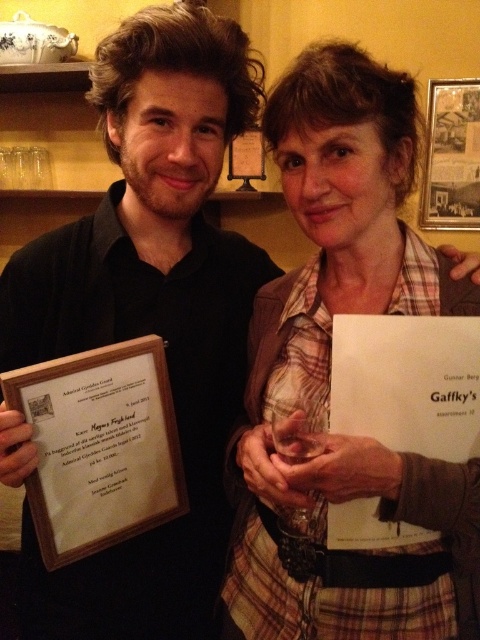
Question: Among these points, which one is nearest to the camera?

Choices:
 (A) (7, 333)
 (B) (464, 339)

Answer: (B)

Question: Estimate the real-world distances between objects in this image. Which object is closer to the wooden plaque at center?

Choices:
 (A) plaid fabric shirt at center
 (B) matte black shirt at center
 (C) white paper at center

Answer: (B)

Question: Is plaid fabric shirt at center smaller than wooden plaque at center?

Choices:
 (A) no
 (B) yes

Answer: (A)

Question: Which object is positioned closest to the white paper at center?

Choices:
 (A) matte black shirt at center
 (B) wooden plaque at center
 (C) plaid fabric shirt at center

Answer: (C)

Question: Does matte black shirt at center have a smaller size compared to wooden plaque at center?

Choices:
 (A) yes
 (B) no

Answer: (B)

Question: Does matte black shirt at center appear on the left side of white paper at center?

Choices:
 (A) yes
 (B) no

Answer: (A)